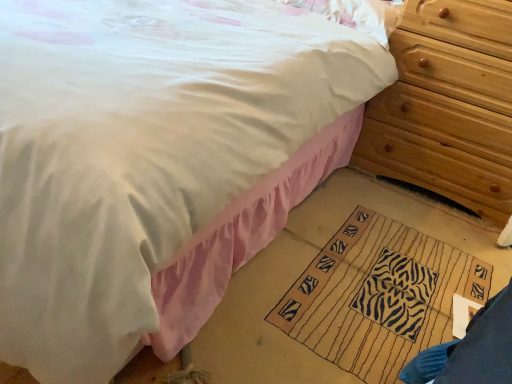
Question: Considering the positions of beige woven mat at lower center and white satin pillow at upper center in the image, is beige woven mat at lower center taller or shorter than white satin pillow at upper center?

Choices:
 (A) short
 (B) tall

Answer: (A)

Question: In the image, is beige woven mat at lower center on the left side or the right side of white satin pillow at upper center?

Choices:
 (A) right
 (B) left

Answer: (A)

Question: Which is nearer to the wooden chest of drawers at right?

Choices:
 (A) beige woven mat at lower center
 (B) white satin pillow at upper center

Answer: (B)

Question: Which of these objects is positioned farthest from the white satin pillow at upper center?

Choices:
 (A) wooden chest of drawers at right
 (B) beige woven mat at lower center

Answer: (B)